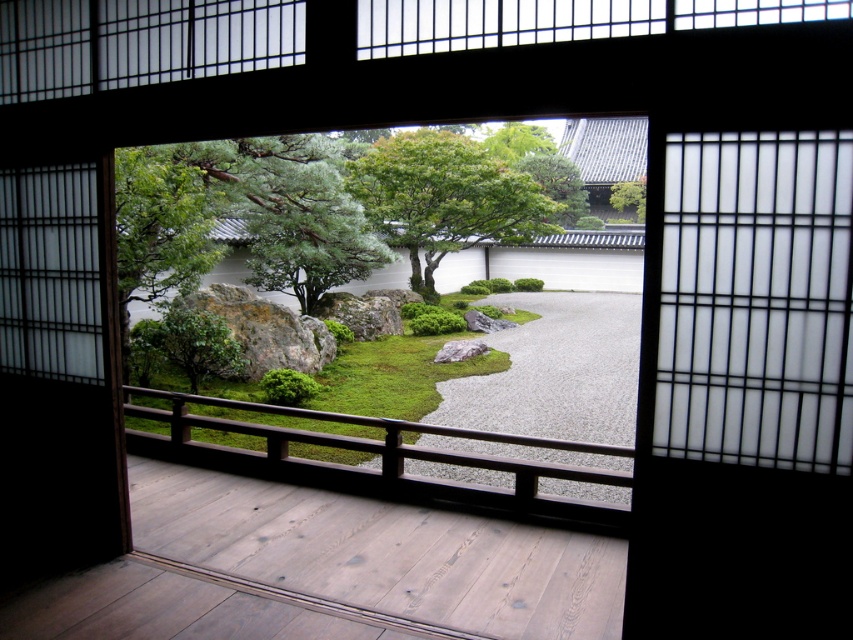
Does green leafy tree at center appear under green leafy tree at upper right?

Yes.

Is point (440, 172) less distant than point (634, 202)?

Yes.

Locate an element on the screen. Image resolution: width=853 pixels, height=640 pixels. green leafy tree at center is located at coordinates (444, 198).

Does white paper at left have a greater height compared to green grassy rock at center?

Correct, white paper at left is much taller as green grassy rock at center.

Measure the distance between point [51,212] and camera.

A distance of 3.63 meters exists between point [51,212] and camera.

This screenshot has height=640, width=853. What are the coordinates of `white paper at left` in the screenshot? It's located at (50, 273).

Can you confirm if white paper at left is wider than green leafy tree at upper right?

No, white paper at left is not wider than green leafy tree at upper right.

Does point (78, 280) lie in front of point (633, 200)?

Yes, point (78, 280) is closer to viewer.

This screenshot has height=640, width=853. I want to click on white paper at left, so click(x=50, y=273).